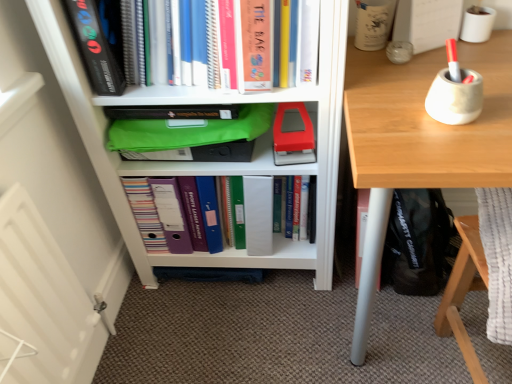
Question: Is hardcover book at upper left, arranged as the first paperback book when viewed from the top, positioned beyond the bounds of green fabric bag at center?

Choices:
 (A) yes
 (B) no

Answer: (A)

Question: Is hardcover book at upper left, arranged as the first paperback book when viewed from the top, wider than green fabric bag at center?

Choices:
 (A) yes
 (B) no

Answer: (B)

Question: Considering the relative positions of hardcover book at upper left, positioned as the 1th paperback book in left-to-right order, and green fabric bag at center in the image provided, is hardcover book at upper left, positioned as the 1th paperback book in left-to-right order, in front of green fabric bag at center?

Choices:
 (A) no
 (B) yes

Answer: (B)

Question: Is hardcover book at upper left, arranged as the first paperback book when viewed from the top, shorter than green fabric bag at center?

Choices:
 (A) yes
 (B) no

Answer: (B)

Question: Is hardcover book at upper left, the second paperback book from the bottom, at the left side of green fabric bag at center?

Choices:
 (A) yes
 (B) no

Answer: (A)

Question: Visually, is hardcover book at upper left, arranged as the first paperback book when viewed from the top, positioned to the left or to the right of matte green plastic bag at center?

Choices:
 (A) right
 (B) left

Answer: (B)

Question: Is point (101, 28) positioned closer to the camera than point (300, 92)?

Choices:
 (A) farther
 (B) closer

Answer: (B)

Question: From a real-world perspective, relative to matte green plastic bag at center, is hardcover book at upper left, the second paperback book positioned from the right, vertically above or below?

Choices:
 (A) above
 (B) below

Answer: (A)

Question: In terms of size, does hardcover book at upper left, arranged as the first paperback book when viewed from the top, appear bigger or smaller than matte green plastic bag at center?

Choices:
 (A) big
 (B) small

Answer: (B)

Question: From the image's perspective, relative to matte plastic folder at center, which is the first book in bottom-to-top order, is hardcover book at upper center, which is the third book in bottom-to-top order, above or below?

Choices:
 (A) below
 (B) above

Answer: (B)

Question: Which is correct: hardcover book at upper center, which appears as the first book when viewed from the top, is inside matte plastic folder at center, which is counted as the third book, starting from the top, or outside of it?

Choices:
 (A) outside
 (B) inside

Answer: (A)

Question: From a real-world perspective, is hardcover book at upper center, which is the third book in bottom-to-top order, above or below matte plastic folder at center, which is the first book in bottom-to-top order?

Choices:
 (A) above
 (B) below

Answer: (A)

Question: Is point (285, 4) closer or farther from the camera than point (197, 220)?

Choices:
 (A) closer
 (B) farther

Answer: (A)

Question: In the image, is light wood desk at right on the left side or the right side of hardcover book at center, placed as the second book when sorted from top to bottom?

Choices:
 (A) right
 (B) left

Answer: (A)

Question: Relative to hardcover book at center, arranged as the 2th book when ordered from the bottom, is light wood desk at right in front or behind?

Choices:
 (A) behind
 (B) front

Answer: (B)